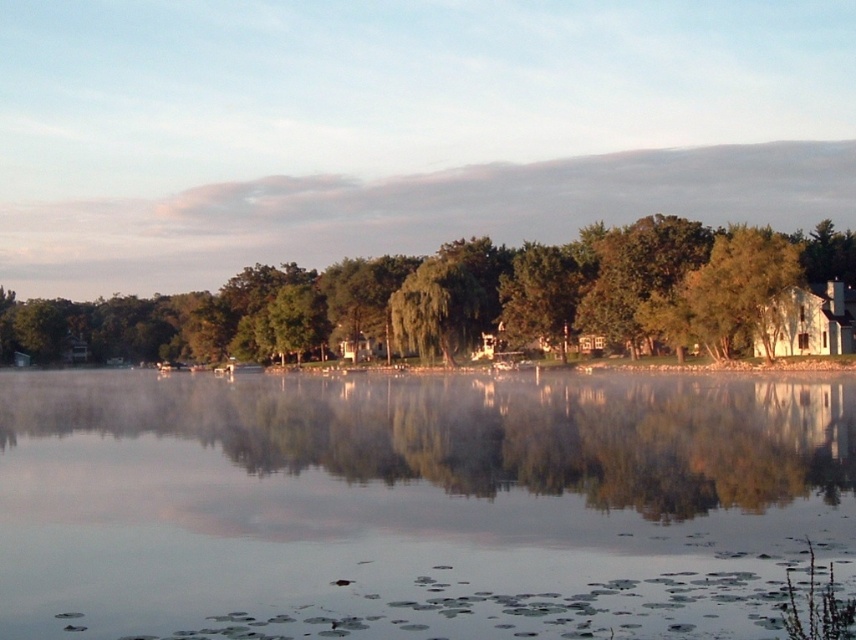
Between white translucent fog at upper center and green leafy tree at lower left, which one is positioned higher?

white translucent fog at upper center

In order to click on white translucent fog at upper center in this screenshot , I will do `click(400, 128)`.

Which of these two, transparent water at center or white translucent fog at upper center, stands shorter?

Standing shorter between the two is transparent water at center.

Does transparent water at center have a lesser height compared to white translucent fog at upper center?

Correct, transparent water at center is not as tall as white translucent fog at upper center.

Between point (566, 524) and point (405, 182), which one is positioned behind?

The point (405, 182) is more distant.

I want to click on transparent water at center, so click(x=415, y=502).

Between point (500, 614) and point (325, 356), which one is positioned in front?

Point (500, 614) is in front.

Can you confirm if transparent water at center is positioned below green leafy tree at lower left?

Correct, transparent water at center is located below green leafy tree at lower left.

Who is more distant from viewer, (681, 536) or (726, 323)?

The point (726, 323) is more distant.

The height and width of the screenshot is (640, 856). Identify the location of transparent water at center. [x=415, y=502].